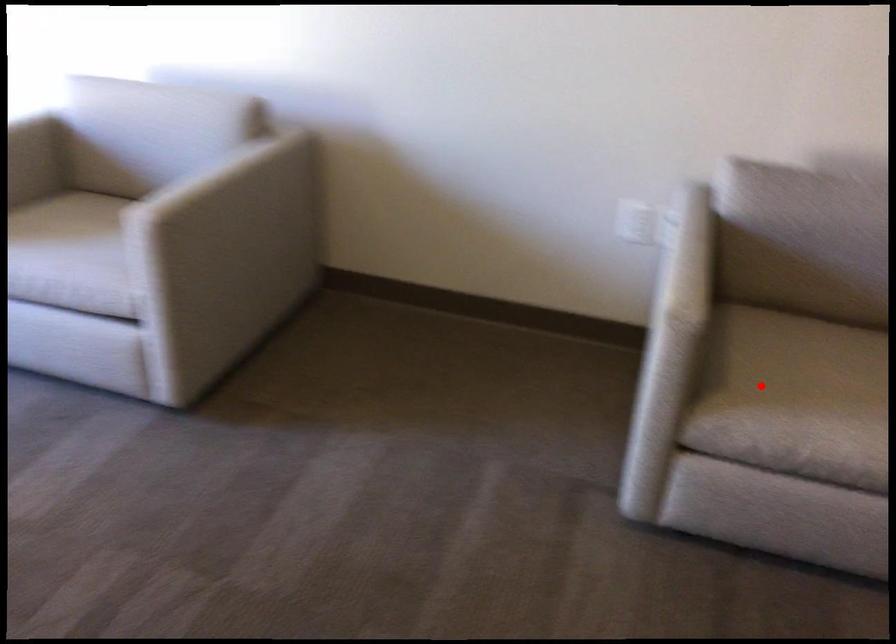
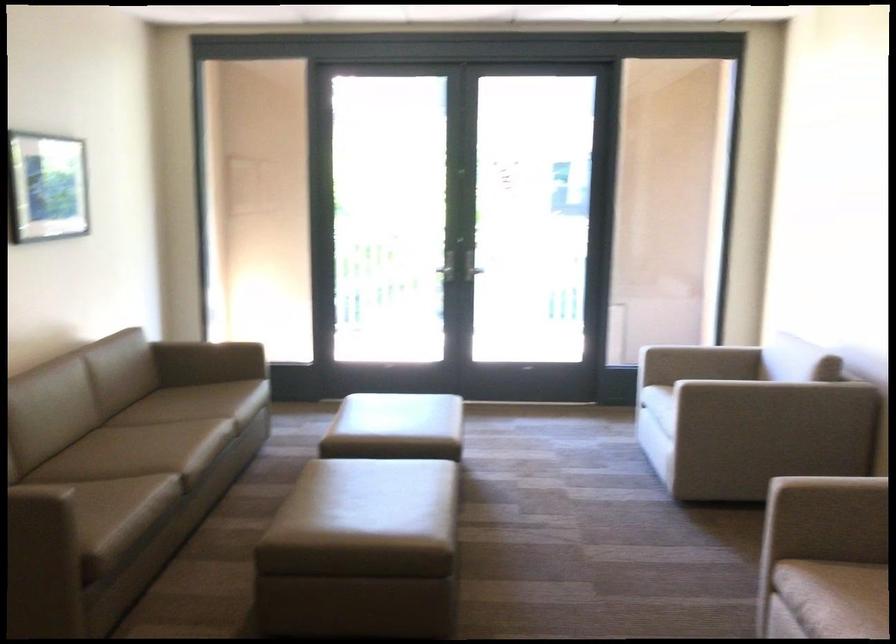
Locate, in the second image, the point that corresponds to the highlighted location in the first image.

(856, 591)